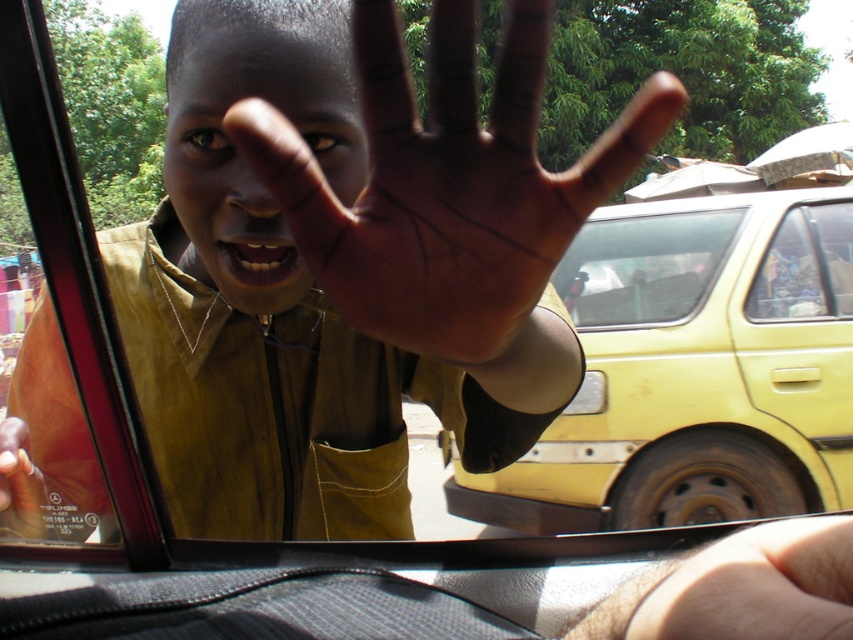
Looking at this image, you are a passenger in the car and want to wave to the person outside. Can you extend your hand through the transparent plastic car window at center to reach them? Please explain based on the size of the brown skin hand at center and the window.

The brown skin hand at center has a lesser width compared to the transparent plastic car window at center, so yes, the hand can fit through the window to wave.

You are standing 2 meters away from the yellow matte car window at center. Can you reach the window to clean it with a cloth?

The distance between you and the yellow matte car window at center is 3.22 meters, so you cannot reach it with a cloth from 2 meters away.

You are a passenger in a car and see the brown skin hand at center and the transparent plastic car window at center. Which object is closer to you?

The brown skin hand at center is closer to you than the transparent plastic car window at center according to the description.